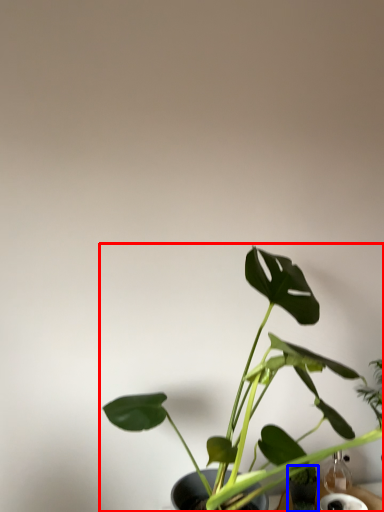
Question: Which of the following is the farthest to the observer, houseplant (highlighted by a red box) or glass vase (highlighted by a blue box)?

Choices:
 (A) houseplant
 (B) glass vase

Answer: (B)